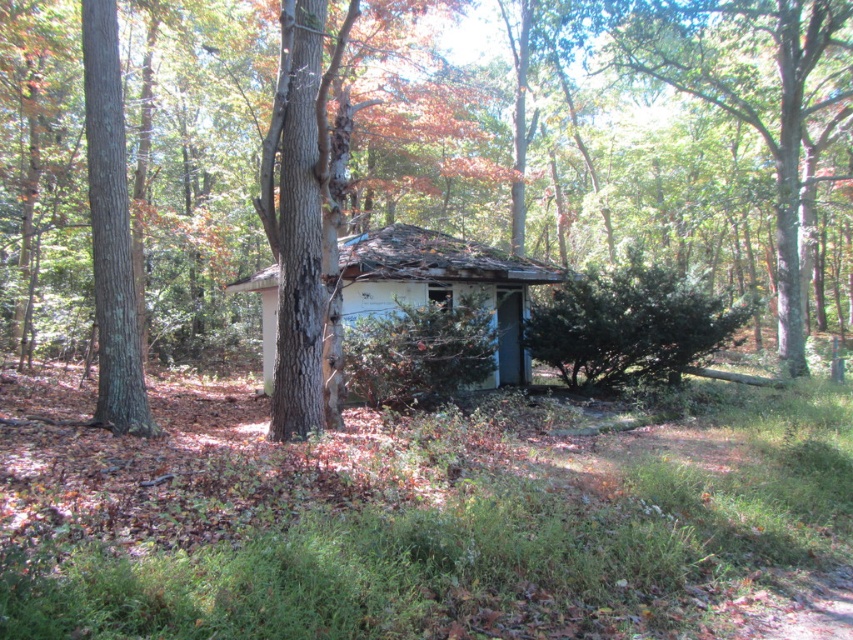
Which is above, white weathered hut at center or brown rough tree at left?

Positioned higher is brown rough tree at left.

Between white weathered hut at center and brown rough tree at left, which one appears on the left side from the viewer's perspective?

From the viewer's perspective, brown rough tree at left appears more on the left side.

Does point (432, 268) lie in front of point (109, 99)?

That is False.

The image size is (853, 640). In order to click on white weathered hut at center in this screenshot , I will do `click(444, 284)`.

Between point (747, 100) and point (515, 337), which one is positioned behind?

The point (747, 100) is behind.

How distant is green leafy tree at upper right from white weathered hut at center?

A distance of 11.00 meters exists between green leafy tree at upper right and white weathered hut at center.

Who is more forward, (718, 76) or (350, 266)?

Point (350, 266) is in front.

Where is `green leafy tree at upper right`? green leafy tree at upper right is located at coordinates (747, 90).

Who is taller, brown rough tree at center or green leafy tree at upper right?

With more height is brown rough tree at center.

Between brown rough tree at center and green leafy tree at upper right, which one is positioned lower?

Positioned lower is green leafy tree at upper right.

Where is `brown rough tree at center`? This screenshot has height=640, width=853. brown rough tree at center is located at coordinates (509, 172).

Find the location of a particular element. brown rough tree at center is located at coordinates (509, 172).